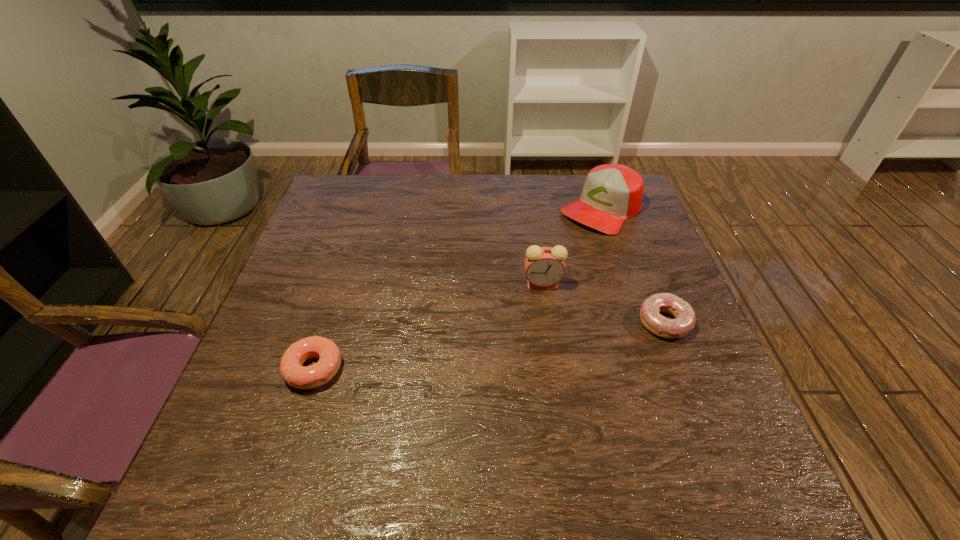
Where is `free space on the desktop that is between the nearer doughnut and the right doughnut and is positioned on the face of the second farthest object`? This screenshot has width=960, height=540. free space on the desktop that is between the nearer doughnut and the right doughnut and is positioned on the face of the second farthest object is located at coordinates tap(472, 348).

Where is `vacant space on the desktop that is between the leftmost object and the third farthest object and is positioned on the front-facing side of the baseball cap`? vacant space on the desktop that is between the leftmost object and the third farthest object and is positioned on the front-facing side of the baseball cap is located at coordinates (444, 352).